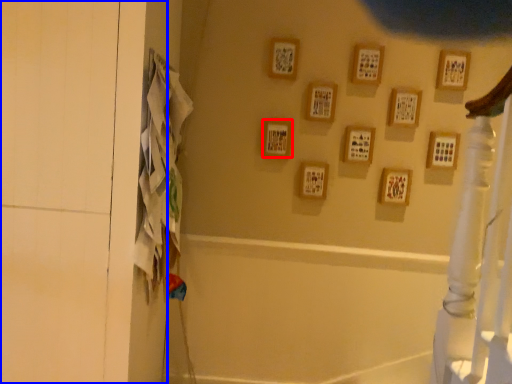
Question: Among these objects, which one is nearest to the camera, picture frame (highlighted by a red box) or screen door (highlighted by a blue box)?

Choices:
 (A) picture frame
 (B) screen door

Answer: (B)